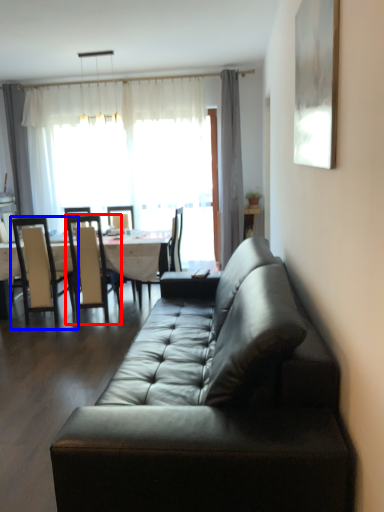
Question: Which of the following is the closest to the observer, chair (highlighted by a red box) or chair (highlighted by a blue box)?

Choices:
 (A) chair
 (B) chair

Answer: (B)